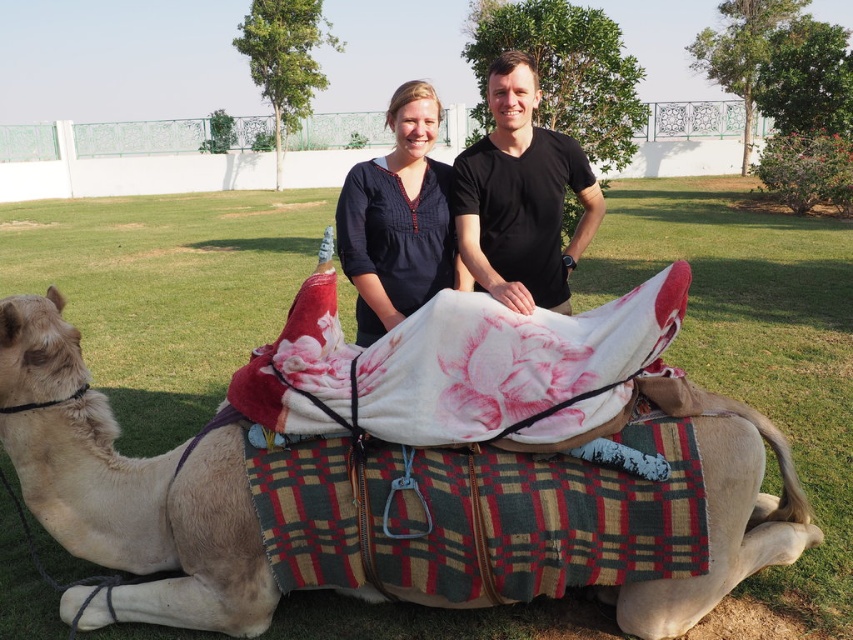
Based on the photo, does beige woolen camel at center have a smaller size compared to black matte shirt at center?

Yes, beige woolen camel at center is smaller than black matte shirt at center.

Who is positioned more to the left, beige woolen camel at center or black matte shirt at center?

Positioned to the left is beige woolen camel at center.

What do you see at coordinates (148, 515) in the screenshot?
I see `beige woolen camel at center` at bounding box center [148, 515].

You are a GUI agent. You are given a task and a screenshot of the screen. Output one action in this format:
    pyautogui.click(x=<x>, y=<y>)
    Task: Click on the beige woolen camel at center
    The height and width of the screenshot is (640, 853).
    Given the screenshot: What is the action you would take?
    (x=148, y=515)

Is floral-patterned fleece blanket at center bigger than dark blue cotton shirt at center?

Indeed, floral-patterned fleece blanket at center has a larger size compared to dark blue cotton shirt at center.

Can you confirm if floral-patterned fleece blanket at center is positioned to the right of dark blue cotton shirt at center?

Correct, you'll find floral-patterned fleece blanket at center to the right of dark blue cotton shirt at center.

What do you see at coordinates (460, 365) in the screenshot? This screenshot has height=640, width=853. I see `floral-patterned fleece blanket at center` at bounding box center [460, 365].

Find the location of a particular element. The height and width of the screenshot is (640, 853). floral-patterned fleece blanket at center is located at coordinates (460, 365).

Does point (720, 502) come closer to viewer compared to point (437, 172)?

Yes, it is.

Is the position of beige woolen camel at center more distant than that of dark blue cotton shirt at center?

No, it is in front of dark blue cotton shirt at center.

Is point (252, 573) less distant than point (345, 196)?

Yes, it is in front of point (345, 196).

This screenshot has height=640, width=853. I want to click on beige woolen camel at center, so click(x=148, y=515).